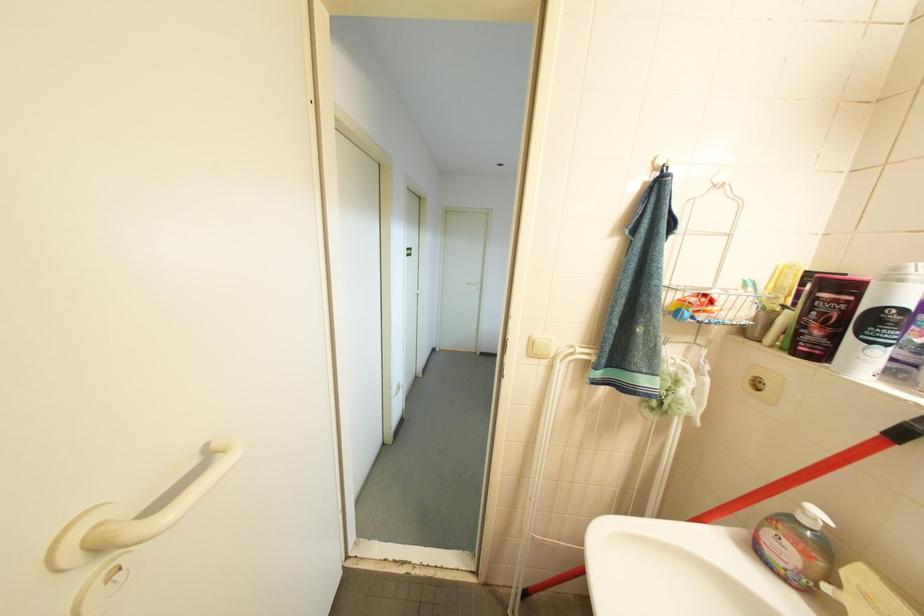
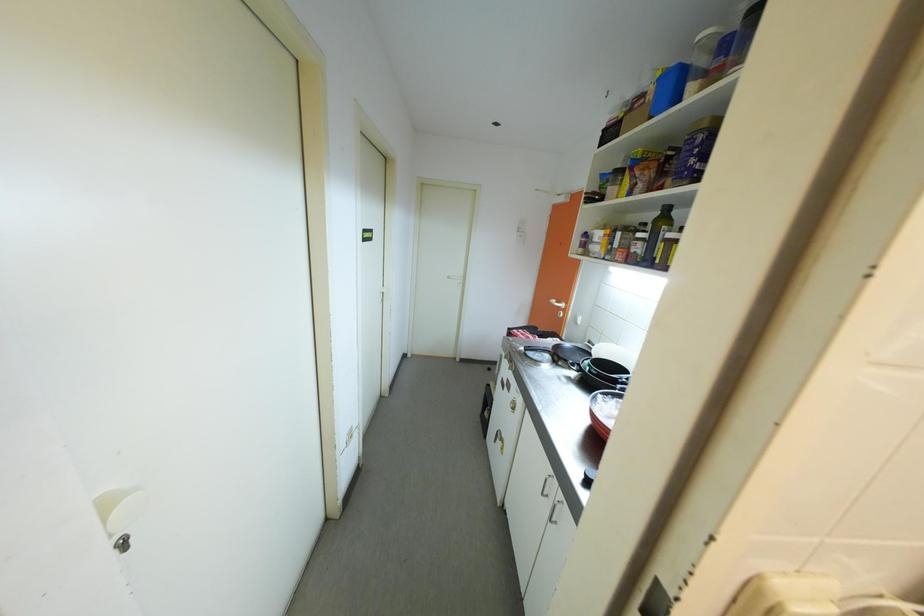
Question: In a continuous first-person perspective shot, in which direction is the camera moving?

Choices:
 (A) Left
 (B) Right
 (C) Forward
 (D) Backward

Answer: (C)